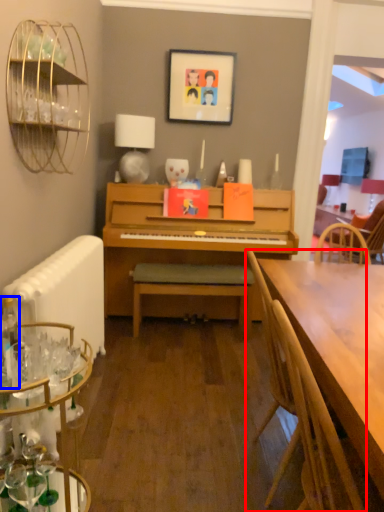
Question: Which object appears closest to the camera in this image, chair (highlighted by a red box) or bottle (highlighted by a blue box)?

Choices:
 (A) chair
 (B) bottle

Answer: (A)